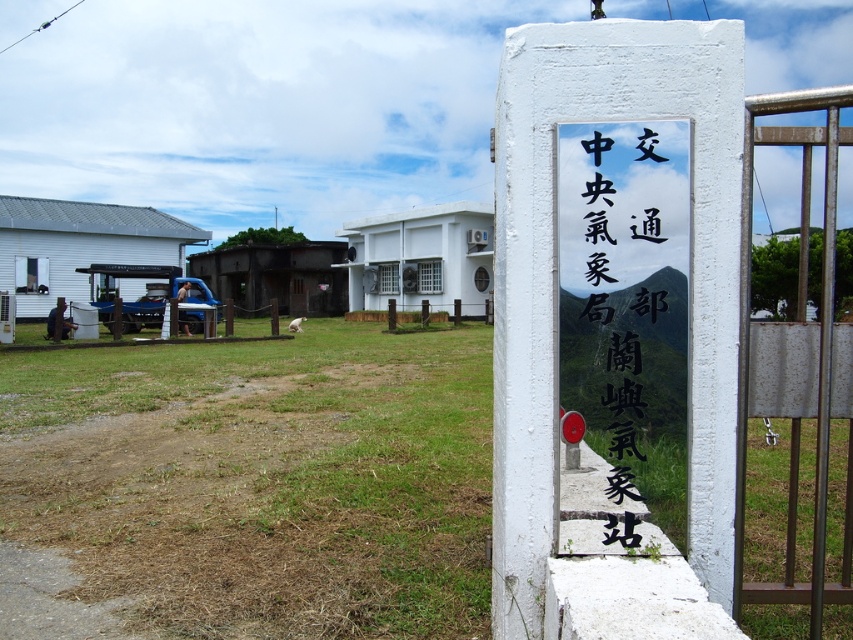
Question: Among these points, which one is farthest from the camera?

Choices:
 (A) (610, 296)
 (B) (802, 227)

Answer: (B)

Question: Does white stone sign at center appear under brown metal gate at right?

Choices:
 (A) yes
 (B) no

Answer: (A)

Question: Is white stone sign at center smaller than brown metal gate at right?

Choices:
 (A) yes
 (B) no

Answer: (A)

Question: Can you confirm if white stone sign at center is positioned to the left of brown metal gate at right?

Choices:
 (A) yes
 (B) no

Answer: (A)

Question: Which of the following is the closest to the observer?

Choices:
 (A) (659, 260)
 (B) (825, 225)

Answer: (A)